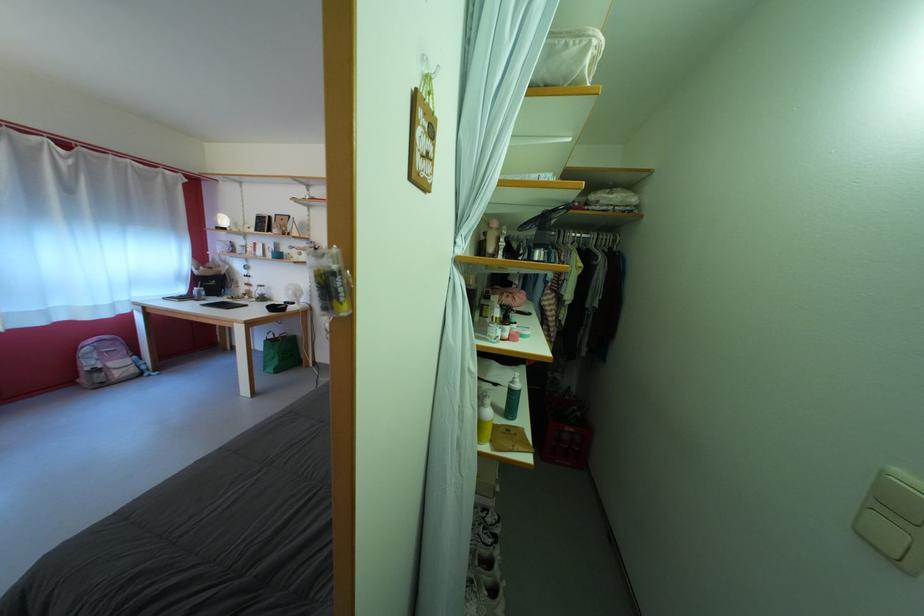
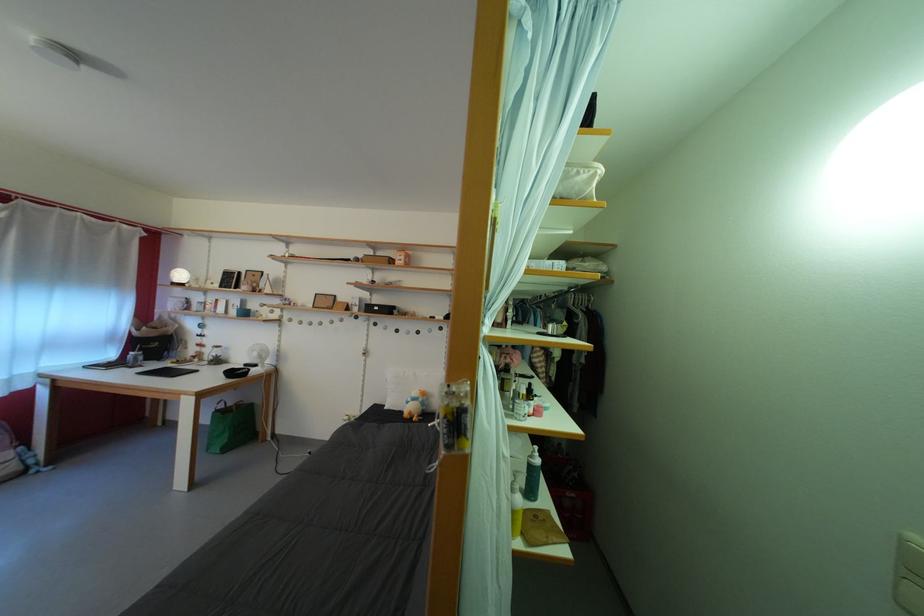
Find the pixel in the second image that matches (520,389) in the first image.

(540, 463)